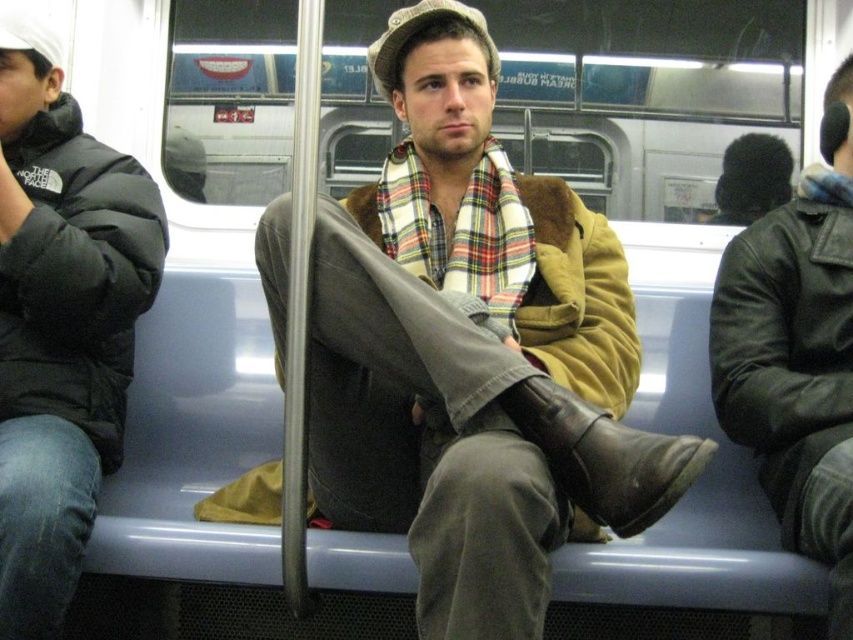
You are a fashion designer observing the subway car scene. You need to decide which item has a greater width for potential design adjustments. Which one is wider between the leather jacket at right and the black fuzzy hat at upper right?

The leather jacket at right is wider than the black fuzzy hat at upper right according to the description.

You are a photographer trying to capture a candid shot of both the leather jacket at right and the black fuzzy hat at upper right in the subway car. Given that your camera can only focus on objects within a 60 cm range, will you be able to include both in a single focused shot?

The leather jacket at right and black fuzzy hat at upper right are 66.10 centimeters apart from each other. Since the distance between them exceeds the camera focus range of 60 cm, you cannot capture both in a single focused shot.

Based on the photo, you are a passenger in the subway car and want to know if the brown fuzzy coat at center is positioned higher than the leather jacket at right. Can you confirm this based on the scene?

The brown fuzzy coat at center is above the leather jacket at right, so yes, it is positioned higher.